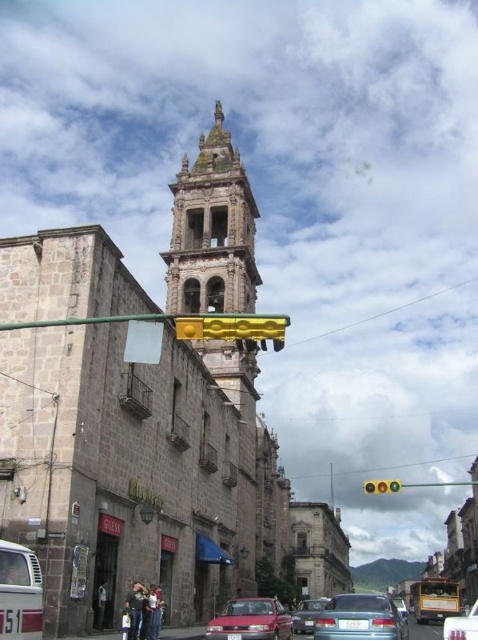
Looking at this image, does matte red car at center have a greater height compared to metallic silver car at center?

In fact, matte red car at center may be shorter than metallic silver car at center.

Between point (282, 609) and point (476, 611), which one is positioned behind?

The point (476, 611) is behind.

This screenshot has height=640, width=478. I want to click on matte red car at center, so point(250,620).

Where is `stone church at center`? This screenshot has height=640, width=478. stone church at center is located at coordinates (141, 410).

Based on the photo, who is shorter, stone church at center or metallic silver sedan at center?

With less height is metallic silver sedan at center.

Is point (163, 472) farther from viewer compared to point (401, 608)?

No, (163, 472) is closer to viewer.

I want to click on stone church at center, so (141, 410).

Does stone bell tower at center appear under metallic silver car at center?

No, stone bell tower at center is not below metallic silver car at center.

Who is positioned more to the left, stone bell tower at center or metallic silver car at center?

stone bell tower at center

Between point (258, 371) and point (445, 636), which one is positioned in front?

Point (445, 636) is in front.

This screenshot has height=640, width=478. What are the coordinates of `stone bell tower at center` in the screenshot? It's located at (212, 230).